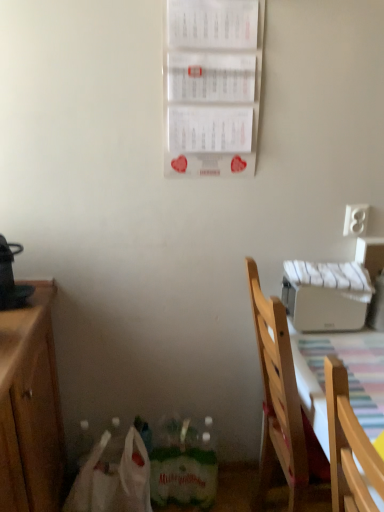
This screenshot has height=512, width=384. What do you see at coordinates (113, 480) in the screenshot? I see `white plastic bag at lower left` at bounding box center [113, 480].

What do you see at coordinates (348, 377) in the screenshot? I see `striped fabric tablecloth at lower right` at bounding box center [348, 377].

Measure the distance between striped fabric tablecloth at lower right and camera.

They are 97.50 centimeters apart.

The image size is (384, 512). Find the location of `white matte printer at upper right`. white matte printer at upper right is located at coordinates (326, 295).

Considering the relative sizes of white matte printer at upper right and light wood chair at lower right in the image provided, is white matte printer at upper right thinner than light wood chair at lower right?

Correct, the width of white matte printer at upper right is less than that of light wood chair at lower right.

The height and width of the screenshot is (512, 384). I want to click on appliance to the right of light wood chair at lower right, so click(x=326, y=295).

Can you confirm if white matte printer at upper right is shorter than light wood chair at lower right?

Yes, white matte printer at upper right is shorter than light wood chair at lower right.

Does white matte printer at upper right turn towards light wood chair at lower right?

Yes, white matte printer at upper right is oriented towards light wood chair at lower right.

Would you say striped fabric tablecloth at lower right is to the left or to the right of white plastic electric outlet at right in the picture?

In the image, striped fabric tablecloth at lower right appears on the right side of white plastic electric outlet at right.

Looking at the image, does striped fabric tablecloth at lower right seem bigger or smaller compared to white plastic electric outlet at right?

striped fabric tablecloth at lower right is bigger than white plastic electric outlet at right.

Does striped fabric tablecloth at lower right have a lesser height compared to white plastic electric outlet at right?

In fact, striped fabric tablecloth at lower right may be taller than white plastic electric outlet at right.

From the image's perspective, between white plastic electric outlet at right and light wood chair at lower right, who is located below?

light wood chair at lower right.

Is white plastic electric outlet at right to the left or to the right of light wood chair at lower right in the image?

In the image, white plastic electric outlet at right appears on the right side of light wood chair at lower right.

Based on the photo, which is closer to the camera, (359, 231) or (249, 262)?

Point (359, 231) is farther from the camera than point (249, 262).

Does striped fabric tablecloth at lower right touch white paper calendar at upper center?

No, striped fabric tablecloth at lower right is not in contact with white paper calendar at upper center.

Consider the image. From a real-world perspective, between striped fabric tablecloth at lower right and white paper calendar at upper center, who is vertically higher?

From a 3D spatial view, white paper calendar at upper center is above.

Between striped fabric tablecloth at lower right and white paper calendar at upper center, which one is positioned in front?

striped fabric tablecloth at lower right is more forward.

Which of these two, white plastic bag at lower left or striped fabric tablecloth at lower right, stands shorter?

white plastic bag at lower left.

How different are the orientations of white plastic bag at lower left and striped fabric tablecloth at lower right in degrees?

The angular difference between white plastic bag at lower left and striped fabric tablecloth at lower right is 103 degrees.

In terms of size, does white plastic bag at lower left appear bigger or smaller than striped fabric tablecloth at lower right?

Considering their sizes, white plastic bag at lower left takes up less space than striped fabric tablecloth at lower right.

Which object is positioned more to the left, white matte printer at upper right or white plastic electric outlet at right?

white matte printer at upper right is more to the left.

Who is more distant, white matte printer at upper right or white plastic electric outlet at right?

white plastic electric outlet at right.

From a real-world perspective, is white matte printer at upper right under white plastic electric outlet at right?

Yes, from a real-world perspective, white matte printer at upper right is beneath white plastic electric outlet at right.

Where is `appliance that appears on the left of white plastic electric outlet at right`? appliance that appears on the left of white plastic electric outlet at right is located at coordinates (326, 295).

From a real-world perspective, is white paper calendar at upper center on white plastic electric outlet at right?

Yes, from a real-world perspective, white paper calendar at upper center is on top of white plastic electric outlet at right.

Can you confirm if white paper calendar at upper center is shorter than white plastic electric outlet at right?

In fact, white paper calendar at upper center may be taller than white plastic electric outlet at right.

Can you confirm if white paper calendar at upper center is bigger than white plastic electric outlet at right?

Correct, white paper calendar at upper center is larger in size than white plastic electric outlet at right.

Would you say white paper calendar at upper center is a long distance from white plastic electric outlet at right?

No, white paper calendar at upper center is not far away from white plastic electric outlet at right.

Where is `appliance that appears above the light wood chair at lower right (from the image's perspective)`? appliance that appears above the light wood chair at lower right (from the image's perspective) is located at coordinates (326, 295).

What are the coordinates of `tablecloth below the white plastic electric outlet at right (from the image's perspective)` in the screenshot? It's located at (348, 377).

Looking at the image, which one is located closer to white plastic bag at lower left, white plastic electric outlet at right or light wood chair at lower right?

light wood chair at lower right is closer to white plastic bag at lower left.

Estimate the real-world distances between objects in this image. Which object is further from striped fabric tablecloth at lower right, white paper calendar at upper center or white plastic bag at lower left?

white paper calendar at upper center.

Based on the photo, considering their positions, is white paper calendar at upper center positioned further to white matte printer at upper right than light wood chair at lower right?

white paper calendar at upper center.

Based on their spatial positions, is white paper calendar at upper center or white plastic electric outlet at right further from white plastic bag at lower left?

white plastic electric outlet at right is positioned further to the anchor white plastic bag at lower left.

Estimate the real-world distances between objects in this image. Which object is closer to striped fabric tablecloth at lower right, light wood chair at lower right or white plastic electric outlet at right?

light wood chair at lower right.

Which object lies further to the anchor point light wood chair at lower right, white plastic bag at lower left or white plastic electric outlet at right?

The object further to light wood chair at lower right is white plastic electric outlet at right.

Which object lies nearer to the anchor point white paper calendar at upper center, light wood chair at lower right or striped fabric tablecloth at lower right?

Among the two, light wood chair at lower right is located nearer to white paper calendar at upper center.

Considering their positions, is striped fabric tablecloth at lower right positioned closer to white matte printer at upper right than white plastic bag at lower left?

striped fabric tablecloth at lower right is positioned closer to the anchor white matte printer at upper right.

The width and height of the screenshot is (384, 512). I want to click on chair between white paper calendar at upper center and white plastic bag at lower left from top to bottom, so click(284, 411).

The height and width of the screenshot is (512, 384). What are the coordinates of `electric outlet situated between white plastic bag at lower left and striped fabric tablecloth at lower right from left to right` in the screenshot? It's located at (355, 219).

The width and height of the screenshot is (384, 512). In order to click on electric outlet that lies between white paper calendar at upper center and light wood chair at lower right from top to bottom in this screenshot , I will do `click(355, 219)`.

Where is `appliance that lies between white paper calendar at upper center and light wood chair at lower right from top to bottom`? The image size is (384, 512). appliance that lies between white paper calendar at upper center and light wood chair at lower right from top to bottom is located at coordinates (326, 295).